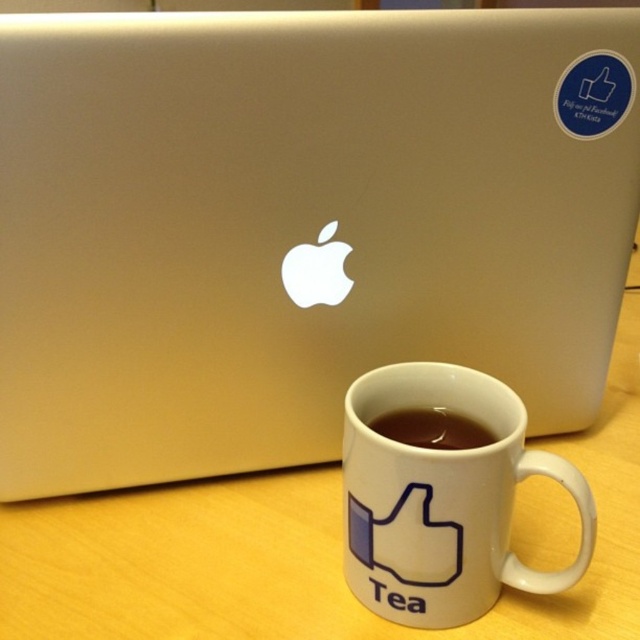
Question: Is white ceramic mug at lower center positioned before brown matte coffee at center?

Choices:
 (A) no
 (B) yes

Answer: (B)

Question: Is white ceramic mug at lower center positioned in front of brown matte coffee at center?

Choices:
 (A) yes
 (B) no

Answer: (A)

Question: Which point is farther from the camera taking this photo?

Choices:
 (A) (412, 438)
 (B) (428, 528)

Answer: (A)

Question: Can you confirm if white ceramic mug at lower center is positioned below brown matte coffee at center?

Choices:
 (A) no
 (B) yes

Answer: (B)

Question: Which point is farther to the camera?

Choices:
 (A) (493, 577)
 (B) (417, 444)

Answer: (B)